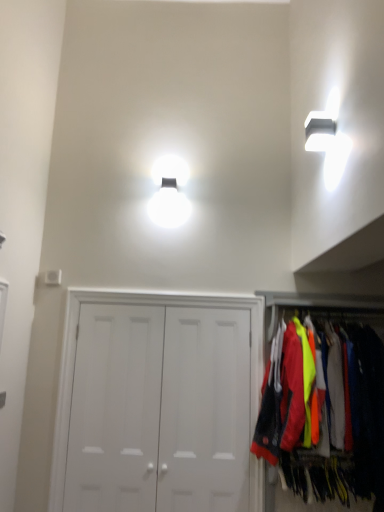
What do you see at coordinates (115, 409) in the screenshot? The height and width of the screenshot is (512, 384). I see `white matte door at center, the third door in the right-to-left sequence` at bounding box center [115, 409].

What is the approximate width of white matte door at center, marked as the third door in a left-to-right arrangement?

2.88 inches.

The height and width of the screenshot is (512, 384). What do you see at coordinates (205, 410) in the screenshot?
I see `white matte door at center, marked as the third door in a left-to-right arrangement` at bounding box center [205, 410].

Measure the distance between neon yellow fabric at right and camera.

The distance of neon yellow fabric at right from camera is 2.75 meters.

At what (x,y) coordinates should I click in order to perform the action: click on white matte door at center, the second door positioned from the left. Please return your answer as a coordinate pair (x, y). The height and width of the screenshot is (512, 384). Looking at the image, I should click on click(158, 403).

At what (x,y) coordinates should I click in order to perform the action: click on white matte door at center, placed as the 1th door when sorted from left to right. Please return your answer as a coordinate pair (x, y). Looking at the image, I should click on (115, 409).

This screenshot has width=384, height=512. Find the location of `closet above the white matte door at center, the third door in the right-to-left sequence (from a real-world perspective)`. closet above the white matte door at center, the third door in the right-to-left sequence (from a real-world perspective) is located at coordinates (320, 305).

Looking at this image, is white matte door at center, placed as the 1th door when sorted from left to right, inside the boundaries of neon yellow fabric at right, or outside?

white matte door at center, placed as the 1th door when sorted from left to right, lies outside neon yellow fabric at right.

In the scene shown: Between white matte door at center, the third door in the right-to-left sequence, and neon yellow fabric at right, which one appears on the left side from the viewer's perspective?

Positioned to the left is white matte door at center, the third door in the right-to-left sequence.

From the image's perspective, which object appears higher, white matte door at center, placed as the 1th door when sorted from left to right, or neon yellow fabric at right?

neon yellow fabric at right appears higher in the image.

Which is more to the right, white matte door at center, placed as the 1th door when sorted from left to right, or white matte door at center, the second door positioned from the left?

Positioned to the right is white matte door at center, the second door positioned from the left.

Is white matte door at center, the third door in the right-to-left sequence, smaller than white matte door at center, the 2th door when ordered from right to left?

Correct, white matte door at center, the third door in the right-to-left sequence, occupies less space than white matte door at center, the 2th door when ordered from right to left.

Is white matte door at center, the third door in the right-to-left sequence, oriented away from white matte door at center, the 2th door when ordered from right to left?

Yes, white matte door at center, the third door in the right-to-left sequence, is facing away from white matte door at center, the 2th door when ordered from right to left.

From the image's perspective, is white matte door at center, marked as the third door in a left-to-right arrangement, on top of white matte door at center, the third door in the right-to-left sequence?

Actually, white matte door at center, marked as the third door in a left-to-right arrangement, appears below white matte door at center, the third door in the right-to-left sequence, in the image.

From their relative heights in the image, would you say white matte door at center, which appears as the first door when viewed from the right, is taller or shorter than white matte door at center, placed as the 1th door when sorted from left to right?

In the image, white matte door at center, which appears as the first door when viewed from the right, appears to be shorter than white matte door at center, placed as the 1th door when sorted from left to right.

Is white matte door at center, the third door in the right-to-left sequence, surrounded by white matte door at center, marked as the third door in a left-to-right arrangement?

No, white matte door at center, the third door in the right-to-left sequence, is not surrounded by white matte door at center, marked as the third door in a left-to-right arrangement.

Which of these two, white matte door at center, marked as the third door in a left-to-right arrangement, or white matte door at center, placed as the 1th door when sorted from left to right, is thinner?

Thinner between the two is white matte door at center, marked as the third door in a left-to-right arrangement.

Identify the location of door located below the white matte door at center, the third door in the right-to-left sequence (from the image's perspective). (205, 410).

From the image's perspective, does white matte door at center, placed as the 1th door when sorted from left to right, appear lower than white matte door at center, which appears as the first door when viewed from the right?

Actually, white matte door at center, placed as the 1th door when sorted from left to right, appears above white matte door at center, which appears as the first door when viewed from the right, in the image.

In the scene shown: Considering the relative sizes of white matte door at center, the third door in the right-to-left sequence, and white matte door at center, marked as the third door in a left-to-right arrangement, in the image provided, is white matte door at center, the third door in the right-to-left sequence, shorter than white matte door at center, marked as the third door in a left-to-right arrangement,?

No, white matte door at center, the third door in the right-to-left sequence, is not shorter than white matte door at center, marked as the third door in a left-to-right arrangement.

From a real-world perspective, is white matte door at center, placed as the 1th door when sorted from left to right, over white matte door at center, marked as the third door in a left-to-right arrangement?

No, from a real-world perspective, white matte door at center, placed as the 1th door when sorted from left to right, is not above white matte door at center, marked as the third door in a left-to-right arrangement.

Considering the positions of objects neon yellow fabric at right and white matte door at center, which appears as the first door when viewed from the right, in the image provided, who is more to the left, neon yellow fabric at right or white matte door at center, which appears as the first door when viewed from the right,?

white matte door at center, which appears as the first door when viewed from the right.

Looking at this image, considering the relative sizes of neon yellow fabric at right and white matte door at center, marked as the third door in a left-to-right arrangement, in the image provided, is neon yellow fabric at right bigger than white matte door at center, marked as the third door in a left-to-right arrangement,?

Correct, neon yellow fabric at right is larger in size than white matte door at center, marked as the third door in a left-to-right arrangement.

From the image's perspective, which object appears higher, neon yellow fabric at right or white matte door at center, marked as the third door in a left-to-right arrangement?

neon yellow fabric at right.

Is neon yellow fabric at right shorter than white matte door at center, the 2th door when ordered from right to left?

Yes, neon yellow fabric at right is shorter than white matte door at center, the 2th door when ordered from right to left.

What's the angular difference between neon yellow fabric at right and white matte door at center, the 2th door when ordered from right to left,'s facing directions?

0.81 degrees separate the facing orientations of neon yellow fabric at right and white matte door at center, the 2th door when ordered from right to left.

Which object is positioned more to the left, neon yellow fabric at right or white matte door at center, the 2th door when ordered from right to left?

white matte door at center, the 2th door when ordered from right to left, is more to the left.

Where is `closet in front of the white matte door at center, the second door positioned from the left`? The image size is (384, 512). closet in front of the white matte door at center, the second door positioned from the left is located at coordinates (320, 305).

Based on the photo, from the image's perspective, between white matte door at center, which appears as the first door when viewed from the right, and neon yellow fabric at right, which one is located above?

From the image's view, neon yellow fabric at right is above.

Which of these two, white matte door at center, which appears as the first door when viewed from the right, or neon yellow fabric at right, is bigger?

neon yellow fabric at right.

The image size is (384, 512). I want to click on closet positioned vertically above the white matte door at center, which appears as the first door when viewed from the right (from a real-world perspective), so click(320, 305).

Is neon yellow fabric at right located within white matte door at center, which appears as the first door when viewed from the right?

No, neon yellow fabric at right is not a part of white matte door at center, which appears as the first door when viewed from the right.

Where is `door that is the 3rd one when counting leftward from the neon yellow fabric at right`? The width and height of the screenshot is (384, 512). door that is the 3rd one when counting leftward from the neon yellow fabric at right is located at coordinates (115, 409).

Identify the location of door that is the 2nd object located in front of the white matte door at center, placed as the 1th door when sorted from left to right. This screenshot has height=512, width=384. (158, 403).

Based on the photo, from the image, which object appears to be farther from white matte door at center, placed as the 1th door when sorted from left to right, white matte door at center, marked as the third door in a left-to-right arrangement, or white matte door at center, the second door positioned from the left?

Among the two, white matte door at center, marked as the third door in a left-to-right arrangement, is located further to white matte door at center, placed as the 1th door when sorted from left to right.

Considering their positions, is white matte door at center, marked as the third door in a left-to-right arrangement, positioned closer to white matte door at center, the 2th door when ordered from right to left, than white matte door at center, placed as the 1th door when sorted from left to right?

white matte door at center, placed as the 1th door when sorted from left to right, is positioned closer to the anchor white matte door at center, the 2th door when ordered from right to left.

Considering their positions, is neon yellow fabric at right positioned closer to white matte door at center, which appears as the first door when viewed from the right, than white matte door at center, placed as the 1th door when sorted from left to right?

white matte door at center, placed as the 1th door when sorted from left to right.

Which object lies further to the anchor point neon yellow fabric at right, white matte door at center, the 2th door when ordered from right to left, or white matte door at center, the third door in the right-to-left sequence?

Among the two, white matte door at center, the third door in the right-to-left sequence, is located further to neon yellow fabric at right.

When comparing their distances from white matte door at center, which appears as the first door when viewed from the right, does white matte door at center, the third door in the right-to-left sequence, or neon yellow fabric at right seem closer?

white matte door at center, the third door in the right-to-left sequence, is positioned closer to the anchor white matte door at center, which appears as the first door when viewed from the right.

Which object lies further to the anchor point white matte door at center, the 2th door when ordered from right to left, white matte door at center, placed as the 1th door when sorted from left to right, or neon yellow fabric at right?

neon yellow fabric at right is further to white matte door at center, the 2th door when ordered from right to left.

Looking at the image, which one is located further to white matte door at center, the third door in the right-to-left sequence, white matte door at center, the second door positioned from the left, or neon yellow fabric at right?

Based on the image, neon yellow fabric at right appears to be further to white matte door at center, the third door in the right-to-left sequence.

From the image, which object appears to be nearer to white matte door at center, the 2th door when ordered from right to left, white matte door at center, marked as the third door in a left-to-right arrangement, or neon yellow fabric at right?

Among the two, white matte door at center, marked as the third door in a left-to-right arrangement, is located nearer to white matte door at center, the 2th door when ordered from right to left.

In order to click on door situated between white matte door at center, the second door positioned from the left, and neon yellow fabric at right from left to right in this screenshot , I will do [x=205, y=410].

Image resolution: width=384 pixels, height=512 pixels. Identify the location of door between white matte door at center, placed as the 1th door when sorted from left to right, and white matte door at center, marked as the third door in a left-to-right arrangement, in the horizontal direction. (158, 403).